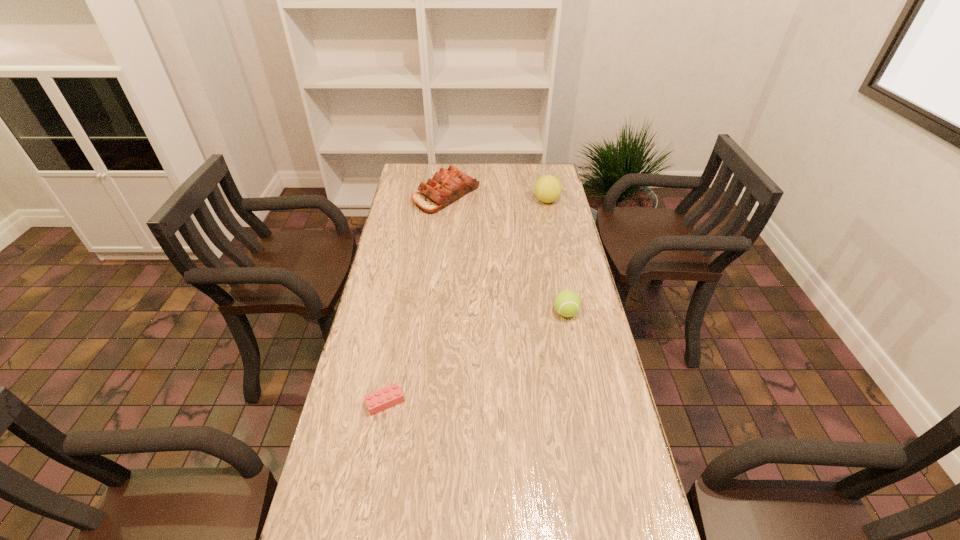
Where is `free space between the Lego and the bread`? The width and height of the screenshot is (960, 540). free space between the Lego and the bread is located at coordinates (416, 298).

The height and width of the screenshot is (540, 960). What are the coordinates of `free space between the third tallest object and the shortest object` in the screenshot? It's located at (475, 357).

Identify the location of free spot between the bread and the farther tennis ball. (496, 198).

The image size is (960, 540). In order to click on free area in between the nearest object and the shorter tennis ball in this screenshot , I will do `click(475, 357)`.

At what (x,y) coordinates should I click in order to perform the action: click on free space that is in between the bread and the taller tennis ball. Please return your answer as a coordinate pair (x, y). Looking at the image, I should click on (496, 198).

Where is `blank region between the shortest object and the bread`? The height and width of the screenshot is (540, 960). blank region between the shortest object and the bread is located at coordinates point(416,298).

At what (x,y) coordinates should I click in order to perform the action: click on free space between the shorter tennis ball and the taller tennis ball. Please return your answer as a coordinate pair (x, y). This screenshot has width=960, height=540. Looking at the image, I should click on (557, 256).

Where is `free spot between the farther tennis ball and the shortest object`? free spot between the farther tennis ball and the shortest object is located at coordinates (466, 301).

Locate which object ranks in proximity to the nearest object. Please provide its 2D coordinates. Your answer should be formatted as a tuple, i.e. [(x, y)], where the tuple contains the x and y coordinates of a point satisfying the conditions above.

[(567, 303)]

You are a GUI agent. You are given a task and a screenshot of the screen. Output one action in this format:
    pyautogui.click(x=<x>, y=<y>)
    Task: Click on the object that is the closest to the taller tennis ball
    The width and height of the screenshot is (960, 540).
    Given the screenshot: What is the action you would take?
    pyautogui.click(x=447, y=186)